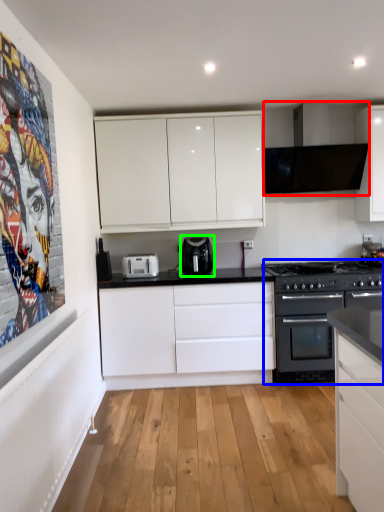
Question: Based on their relative distances, which object is nearer to exhaust hood (highlighted by a red box)? Choose from appliance (highlighted by a blue box) and kitchen appliance (highlighted by a green box).

Choices:
 (A) appliance
 (B) kitchen appliance

Answer: (A)